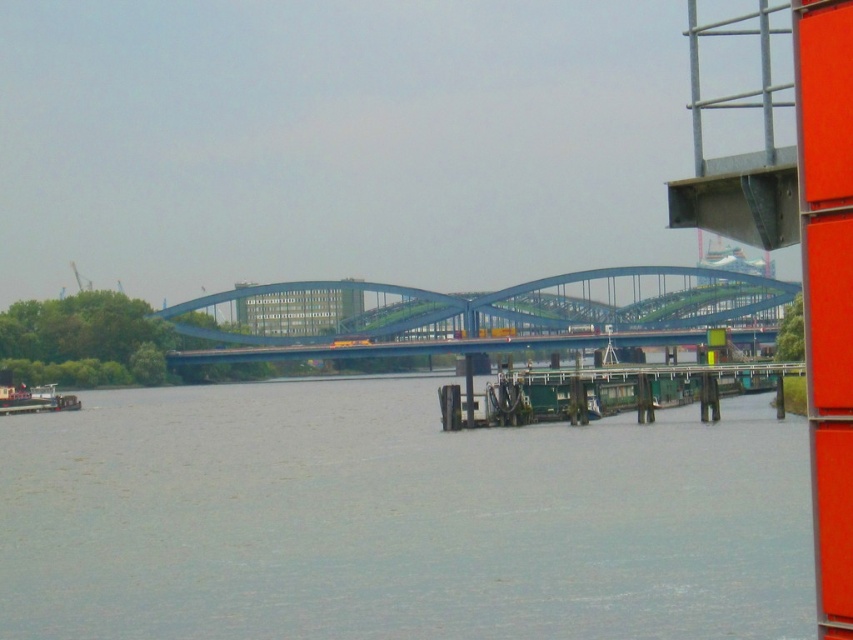
Which is more to the right, gray water at center or green wooden dock at lower right?

green wooden dock at lower right

Is gray water at center behind green wooden dock at lower right?

No, gray water at center is closer to the viewer.

Which is behind, point (108, 456) or point (668, 400)?

Positioned behind is point (668, 400).

You are a GUI agent. You are given a task and a screenshot of the screen. Output one action in this format:
    pyautogui.click(x=<x>, y=<y>)
    Task: Click on the gray water at center
    
    Given the screenshot: What is the action you would take?
    pyautogui.click(x=397, y=520)

Is gray water at center taller than white plastic boat at lower left?

Yes.

Is point (107, 515) behind point (65, 403)?

That is False.

The image size is (853, 640). What are the coordinates of `gray water at center` in the screenshot? It's located at (397, 520).

Which is more to the right, gray water at center or blue metallic bridge at center?

blue metallic bridge at center

Is gray water at center shorter than blue metallic bridge at center?

Indeed, gray water at center has a lesser height compared to blue metallic bridge at center.

The height and width of the screenshot is (640, 853). What do you see at coordinates (397, 520) in the screenshot?
I see `gray water at center` at bounding box center [397, 520].

Locate an element on the screen. This screenshot has height=640, width=853. gray water at center is located at coordinates (397, 520).